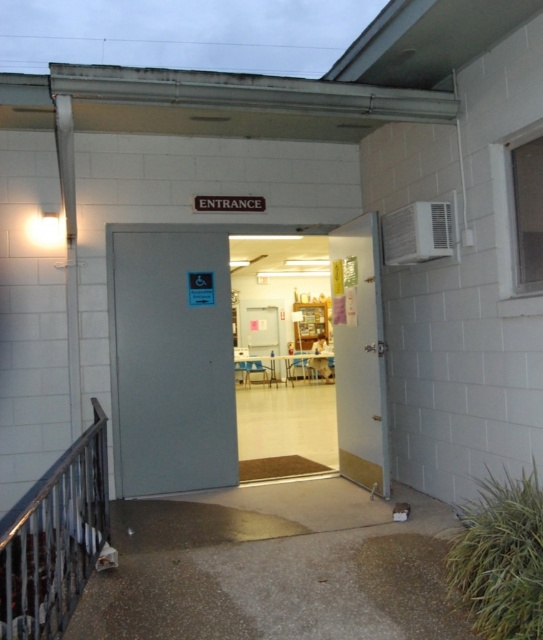
Is point (191, 304) closer to viewer compared to point (55, 556)?

No, it is not.

This screenshot has width=543, height=640. Identify the location of gray matte door at center. (172, 362).

Which is below, metallic gray balustrade at lower left or gold metallic door at center?

Positioned lower is metallic gray balustrade at lower left.

This screenshot has height=640, width=543. Describe the element at coordinates (54, 538) in the screenshot. I see `metallic gray balustrade at lower left` at that location.

Locate an element on the screen. The width and height of the screenshot is (543, 640). metallic gray balustrade at lower left is located at coordinates (54, 538).

Is gray matte door at center bigger than gold metallic door at center?

Incorrect, gray matte door at center is not larger than gold metallic door at center.

This screenshot has height=640, width=543. What do you see at coordinates (172, 362) in the screenshot?
I see `gray matte door at center` at bounding box center [172, 362].

Is point (122, 301) closer to camera compared to point (345, 476)?

Yes, it is in front of point (345, 476).

Where is `gray matte door at center`? The width and height of the screenshot is (543, 640). gray matte door at center is located at coordinates (172, 362).